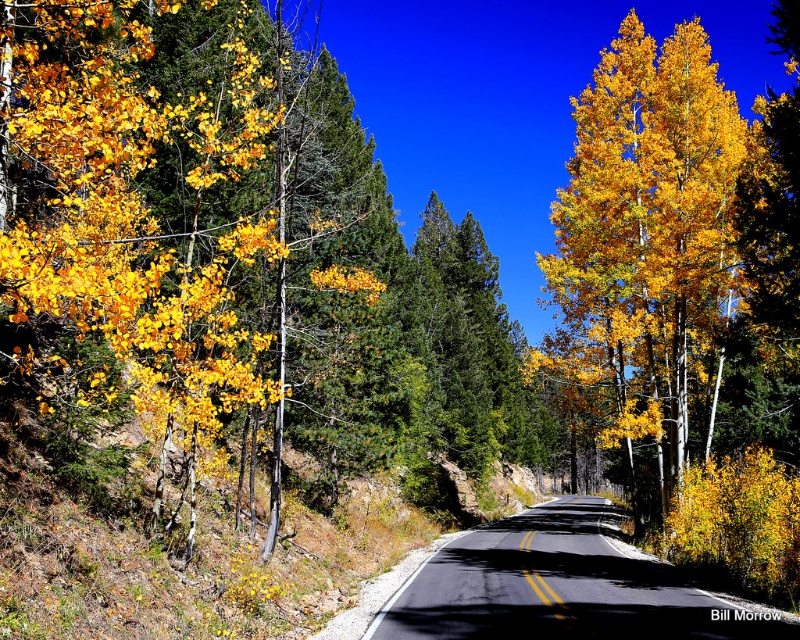
You are a hiker standing on the winding road and see golden yellow leaves at left and golden yellow leaves at right. Which group of leaves is located to the left of the other?

The golden yellow leaves at left are positioned to the left of the golden yellow leaves at right.

You are a hiker standing on the road and looking towards the direction of the road. Where are the golden yellow leaves at right located relative to your position?

The golden yellow leaves at right are located at point [644,252] relative to your position.

You are a driver approaching the black asphalt road at center from the left side of the image. You notice golden yellow leaves at right scattered across the road. Considering the width of the road and the leaves, can you safely drive through the middle without crossing the double yellow lines?

The golden yellow leaves at right are wider than the black asphalt road at center, so the road is narrower than the leaves. Since the road is narrow, driving through the middle while avoiding the double yellow lines may be challenging. It is advisable to proceed with caution or find an alternative route.